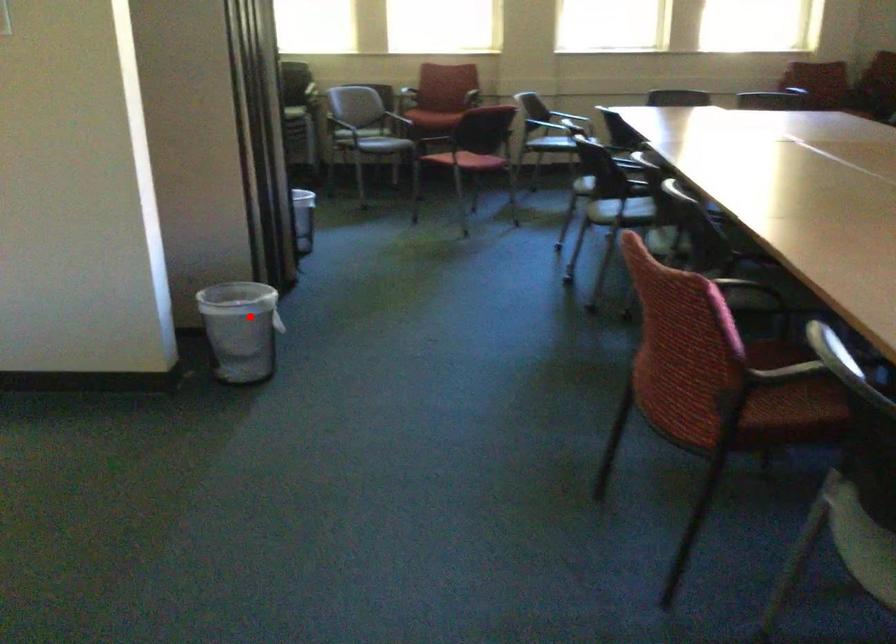
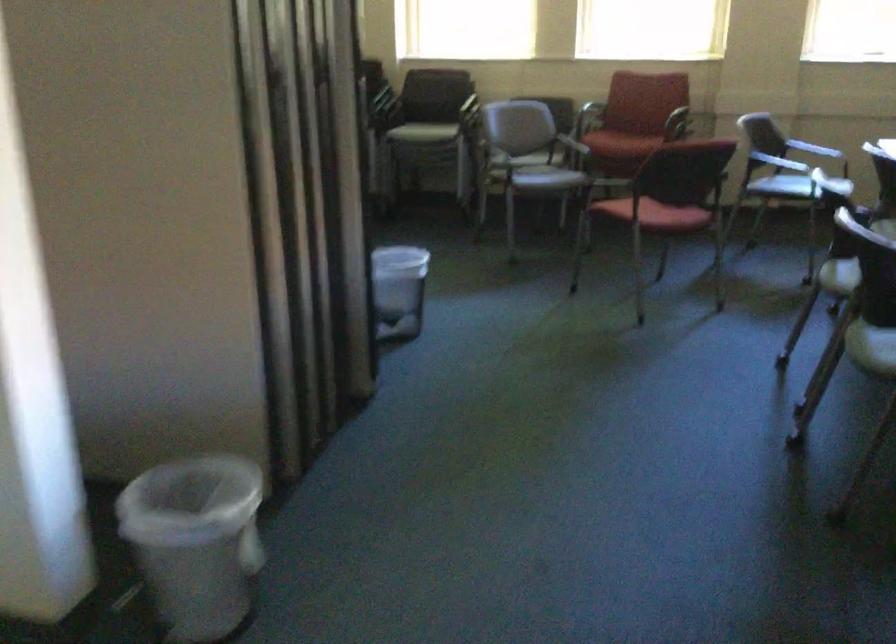
Question: I am providing you with two images of the same scene from different viewpoints. In image1, a red point is highlighted. Considering the same 3D point in image2, which of the following is correct?

Choices:
 (A) It is closer
 (B) It is farther

Answer: (A)